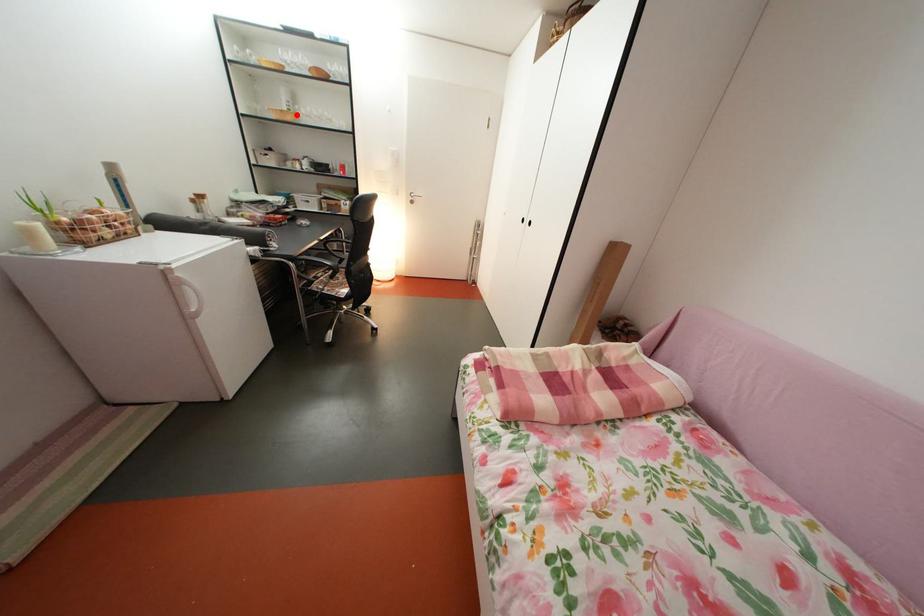
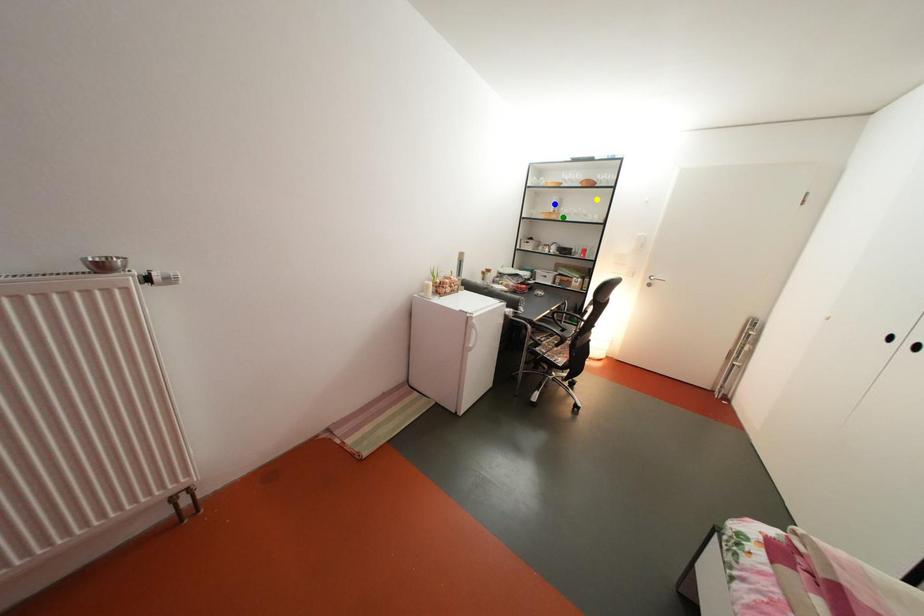
Question: I am providing you with two images of the same scene from different viewpoints. A red point is marked on the first image. You are given multiple points on the second image. In image 2, which mark is for the same physical point as the one in image 1?

Choices:
 (A) yellow point
 (B) green point
 (C) blue point

Answer: (B)